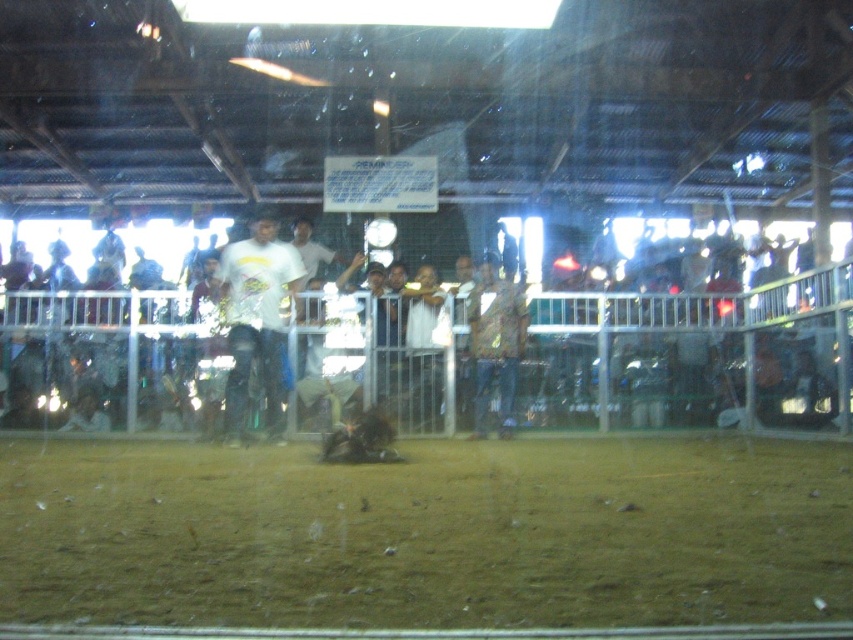
Who is shorter, brown dirt track at center or white matte t-shirt at center?

Standing shorter between the two is brown dirt track at center.

Between brown dirt track at center and white matte t-shirt at center, which one is positioned lower?

Positioned lower is brown dirt track at center.

Between point (181, 538) and point (260, 292), which one is positioned in front?

Point (181, 538)

You are a GUI agent. You are given a task and a screenshot of the screen. Output one action in this format:
    pyautogui.click(x=<x>, y=<y>)
    Task: Click on the brown dirt track at center
    Image resolution: width=853 pixels, height=640 pixels.
    Given the screenshot: What is the action you would take?
    pyautogui.click(x=427, y=532)